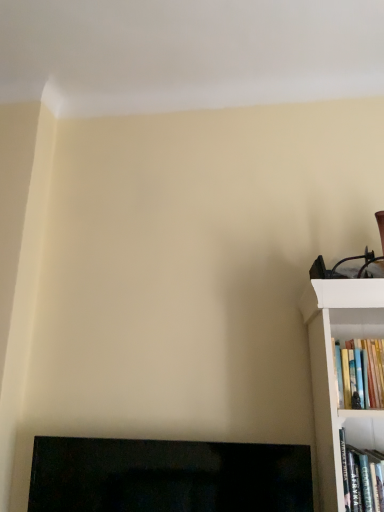
Question: From the image's perspective, does black glossy fireplace at lower left appear lower than hardcover book at right, the 1th book when ordered from bottom to top?

Choices:
 (A) yes
 (B) no

Answer: (A)

Question: Is black glossy fireplace at lower left to the left of hardcover book at right, the 1th book when ordered from bottom to top, from the viewer's perspective?

Choices:
 (A) no
 (B) yes

Answer: (B)

Question: From a real-world perspective, is black glossy fireplace at lower left physically above hardcover book at right, the 1th book when ordered from bottom to top?

Choices:
 (A) no
 (B) yes

Answer: (A)

Question: Is hardcover book at right, which ranks as the second book in top-to-bottom order, at the back of black glossy fireplace at lower left?

Choices:
 (A) yes
 (B) no

Answer: (B)

Question: Is black glossy fireplace at lower left positioned beyond the bounds of hardcover book at right, which ranks as the second book in top-to-bottom order?

Choices:
 (A) yes
 (B) no

Answer: (A)

Question: From a real-world perspective, is black glossy fireplace at lower left located beneath hardcover book at right, which ranks as the second book in top-to-bottom order?

Choices:
 (A) no
 (B) yes

Answer: (B)

Question: From a real-world perspective, is black glossy fireplace at lower left on hardcover books at right, placed as the second book when sorted from bottom to top?

Choices:
 (A) no
 (B) yes

Answer: (A)

Question: Considering the relative sizes of black glossy fireplace at lower left and hardcover books at right, positioned as the first book in top-to-bottom order, in the image provided, is black glossy fireplace at lower left taller than hardcover books at right, positioned as the first book in top-to-bottom order,?

Choices:
 (A) no
 (B) yes

Answer: (B)

Question: Does black glossy fireplace at lower left have a lesser width compared to hardcover books at right, positioned as the first book in top-to-bottom order?

Choices:
 (A) no
 (B) yes

Answer: (B)

Question: Is black glossy fireplace at lower left to the right of hardcover books at right, positioned as the first book in top-to-bottom order, from the viewer's perspective?

Choices:
 (A) no
 (B) yes

Answer: (A)

Question: Is black glossy fireplace at lower left positioned beyond the bounds of hardcover books at right, positioned as the first book in top-to-bottom order?

Choices:
 (A) no
 (B) yes

Answer: (B)

Question: Would you say black glossy fireplace at lower left is a long distance from hardcover books at right, placed as the second book when sorted from bottom to top?

Choices:
 (A) no
 (B) yes

Answer: (A)

Question: Is hardcover book at right, the 1th book when ordered from bottom to top, closer to camera compared to black glossy fireplace at lower left?

Choices:
 (A) no
 (B) yes

Answer: (B)